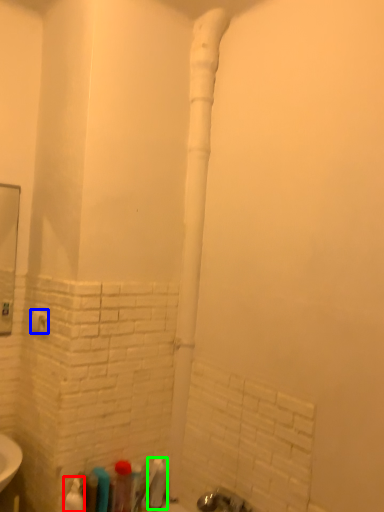
Question: Which object is the farthest from toiletry (highlighted by a red box)? Choose among these: towel bar (highlighted by a blue box) or toiletry (highlighted by a green box).

Choices:
 (A) towel bar
 (B) toiletry

Answer: (A)